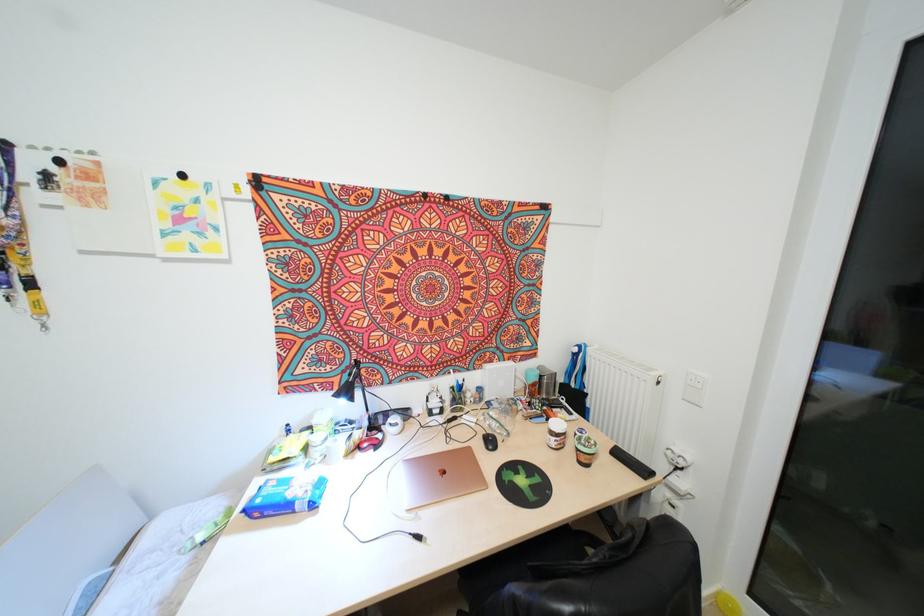
Find where to lift the white jar lid. Please return your answer as a coordinate pair (x, y).

(556, 428)